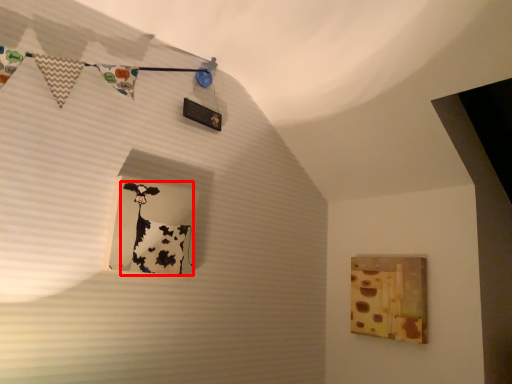
Question: From the image's perspective, where is art (annotated by the red box) located relative to picture frame?

Choices:
 (A) below
 (B) above

Answer: (B)